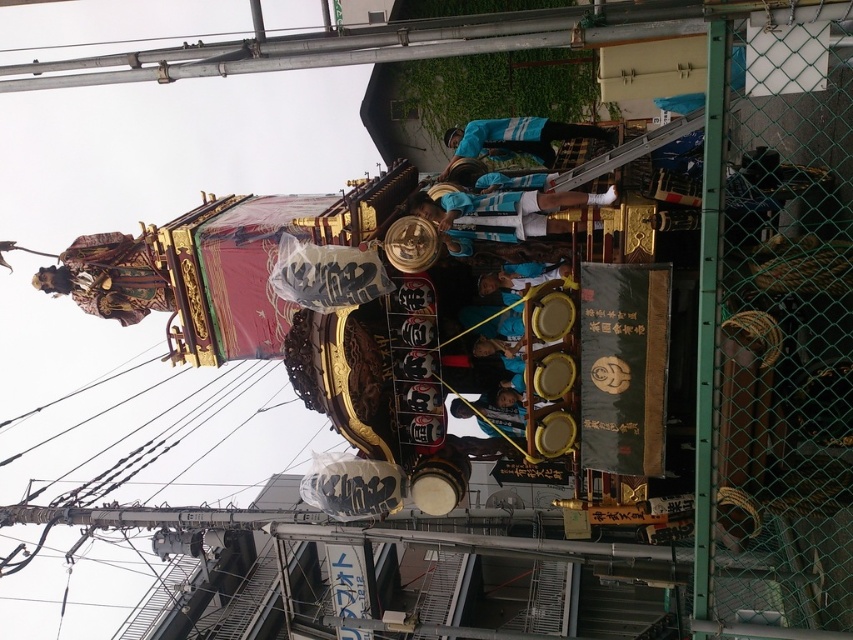
Can you confirm if white jersey at center is taller than blue fabric skateboarder at center?

Incorrect, white jersey at center's height is not larger of blue fabric skateboarder at center's.

Is white jersey at center positioned in front of blue fabric skateboarder at center?

That is True.

Who is more forward, (x=608, y=188) or (x=442, y=140)?

Point (x=608, y=188) is more forward.

Find the location of a particular element. Image resolution: width=853 pixels, height=640 pixels. white jersey at center is located at coordinates (506, 209).

Does green chain-link fence at right have a larger size compared to white jersey at center?

Yes, green chain-link fence at right is bigger than white jersey at center.

Does green chain-link fence at right have a smaller size compared to white jersey at center?

No.

This screenshot has width=853, height=640. Identify the location of green chain-link fence at right. (775, 340).

Who is more forward, (x=738, y=420) or (x=445, y=131)?

Point (x=738, y=420) is more forward.

Is green chain-link fence at right to the right of blue fabric skateboarder at center from the viewer's perspective?

Correct, you'll find green chain-link fence at right to the right of blue fabric skateboarder at center.

Who is more forward, (833, 115) or (547, 136)?

Point (833, 115)

Locate an element on the screen. The height and width of the screenshot is (640, 853). green chain-link fence at right is located at coordinates (775, 340).